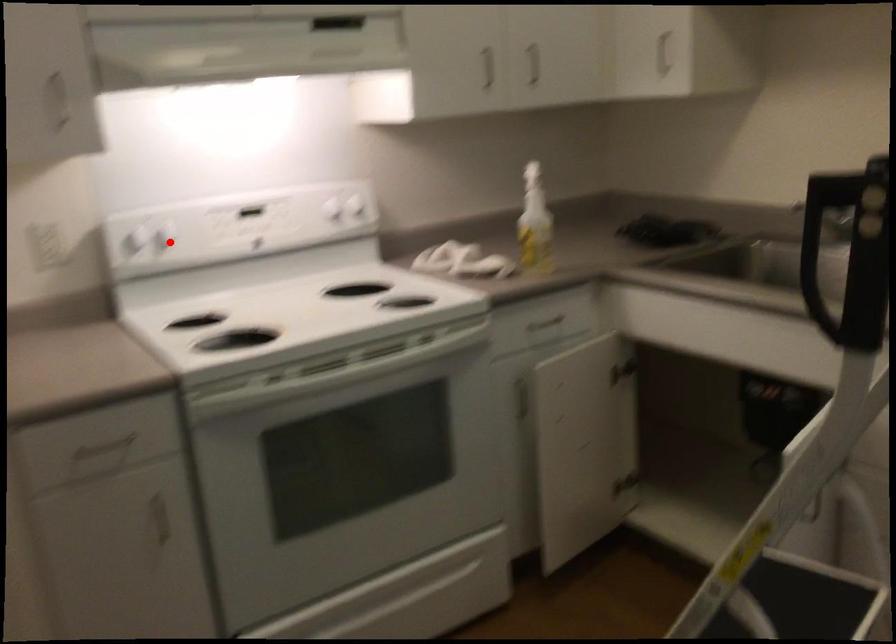
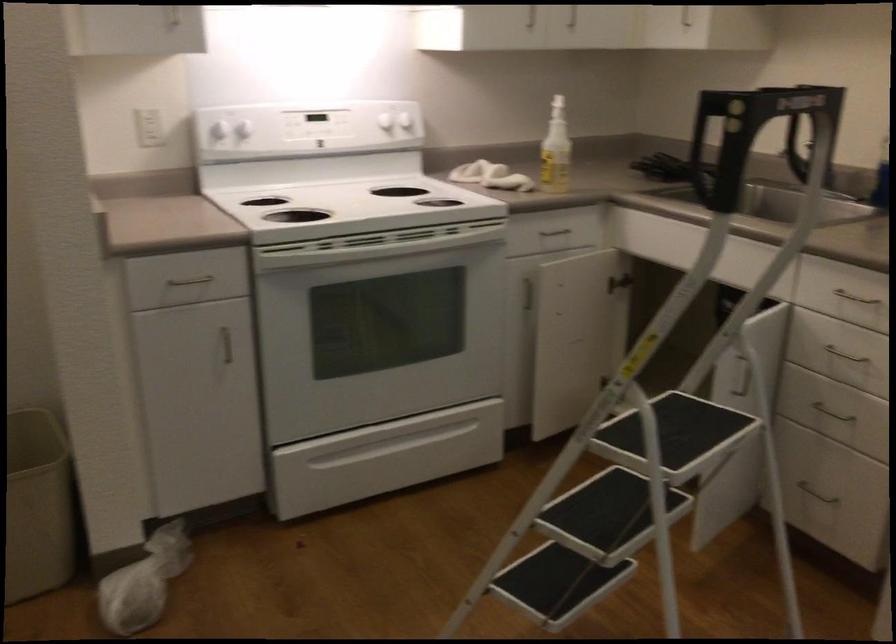
Question: A red point is marked in image1. In image2, is the corresponding 3D point closer to the camera or farther? Reply with the corresponding letter.

Choices:
 (A) The corresponding 3D point is closer.
 (B) The corresponding 3D point is farther.

Answer: (B)